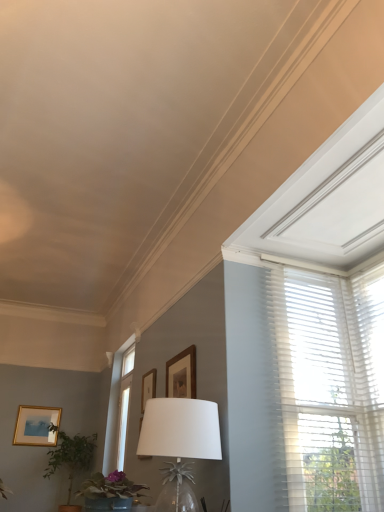
Question: Is white glass table lamp at center facing away from green matte plant at lower left, the second houseplant when ordered from bottom to top?

Choices:
 (A) yes
 (B) no

Answer: (B)

Question: Is green matte plant at lower left, placed as the second houseplant when sorted from back to front, inside white glass table lamp at center?

Choices:
 (A) yes
 (B) no

Answer: (B)

Question: Considering the relative sizes of white glass table lamp at center and green matte plant at lower left, the second houseplant when ordered from bottom to top, in the image provided, is white glass table lamp at center wider than green matte plant at lower left, the second houseplant when ordered from bottom to top,?

Choices:
 (A) no
 (B) yes

Answer: (B)

Question: From the image's perspective, is white glass table lamp at center located beneath green matte plant at lower left, placed as the first houseplant when sorted from top to bottom?

Choices:
 (A) yes
 (B) no

Answer: (B)

Question: Is white glass table lamp at center shorter than green matte plant at lower left, placed as the first houseplant when sorted from top to bottom?

Choices:
 (A) yes
 (B) no

Answer: (B)

Question: From the image's perspective, is white glass table lamp at center above green matte plant at lower left, arranged as the 1th houseplant when viewed from the front?

Choices:
 (A) yes
 (B) no

Answer: (A)

Question: From the image's perspective, is white sheer blinds at upper right on top of matte gold picture frame at lower left, which is counted as the first picture frame, starting from the left?

Choices:
 (A) no
 (B) yes

Answer: (B)

Question: Does white sheer blinds at upper right have a greater width compared to matte gold picture frame at lower left, placed as the 3th picture frame when sorted from top to bottom?

Choices:
 (A) yes
 (B) no

Answer: (A)

Question: Is white sheer blinds at upper right further to the viewer compared to matte gold picture frame at lower left, arranged as the first picture frame when viewed from the back?

Choices:
 (A) yes
 (B) no

Answer: (B)

Question: From a real-world perspective, is white sheer blinds at upper right positioned under matte gold picture frame at lower left, which is counted as the first picture frame, starting from the left, based on gravity?

Choices:
 (A) no
 (B) yes

Answer: (A)

Question: From the image's perspective, is white sheer blinds at upper right located beneath matte gold picture frame at lower left, which is counted as the first picture frame, starting from the left?

Choices:
 (A) yes
 (B) no

Answer: (B)

Question: Does white sheer blinds at upper right have a lesser width compared to matte gold picture frame at lower left, the first picture frame ordered from the bottom?

Choices:
 (A) yes
 (B) no

Answer: (B)

Question: Does white glass table lamp at center come in front of matte gold picture frame at lower left, arranged as the first picture frame when viewed from the back?

Choices:
 (A) no
 (B) yes

Answer: (B)